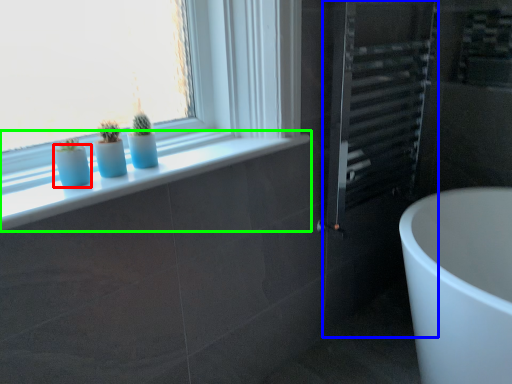
Question: Estimate the real-world distances between objects in this image. Which object is closer to glass vase (highlighted by a red box), screen door (highlighted by a blue box) or window sill (highlighted by a green box)?

Choices:
 (A) screen door
 (B) window sill

Answer: (B)